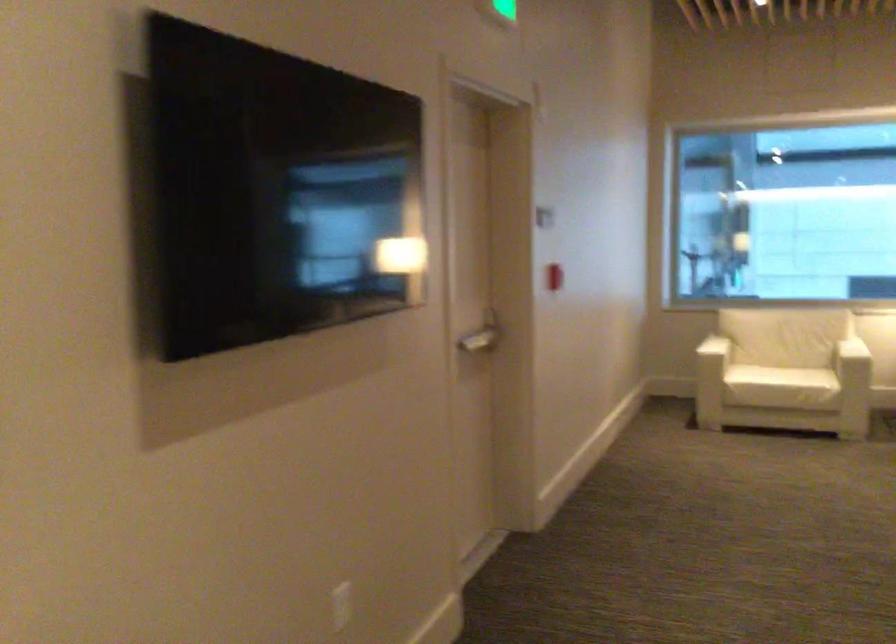
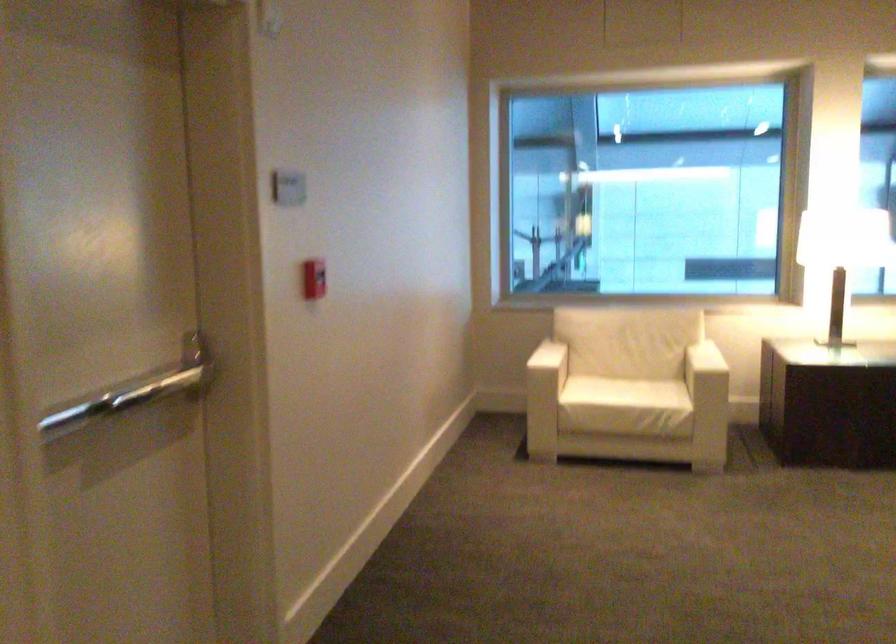
Find the pixel in the second image that matches [780,377] in the first image.

(614, 413)